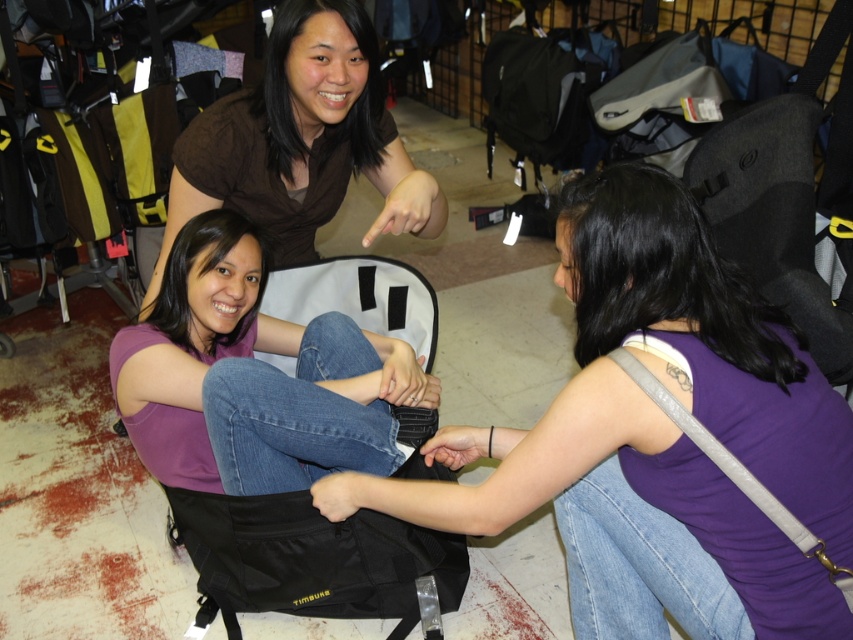
Who is higher up, matte brown shirt at upper center or purple matte shirt at center?

matte brown shirt at upper center is above.

Is matte brown shirt at upper center further to camera compared to purple matte shirt at center?

Yes, matte brown shirt at upper center is further from the viewer.

At what (x,y) coordinates should I click in order to perform the action: click on matte brown shirt at upper center. Please return your answer as a coordinate pair (x, y). The height and width of the screenshot is (640, 853). Looking at the image, I should click on (300, 141).

Where is `matte brown shirt at upper center`? This screenshot has height=640, width=853. matte brown shirt at upper center is located at coordinates (300, 141).

Where is `purple matte tank top at center`? This screenshot has width=853, height=640. purple matte tank top at center is located at coordinates (659, 436).

Looking at this image, is the position of purple matte tank top at center less distant than that of purple matte shirt at center?

Yes, it is.

Between point (650, 624) and point (190, 445), which one is positioned behind?

Point (190, 445)

Image resolution: width=853 pixels, height=640 pixels. Identify the location of purple matte tank top at center. (659, 436).

Can you confirm if purple matte tank top at center is taller than matte brown shirt at upper center?

Yes.

Is purple matte tank top at center bigger than matte brown shirt at upper center?

Indeed, purple matte tank top at center has a larger size compared to matte brown shirt at upper center.

Does point (677, 604) come closer to viewer compared to point (296, 150)?

Yes, point (677, 604) is in front of point (296, 150).

The height and width of the screenshot is (640, 853). I want to click on purple matte tank top at center, so click(x=659, y=436).